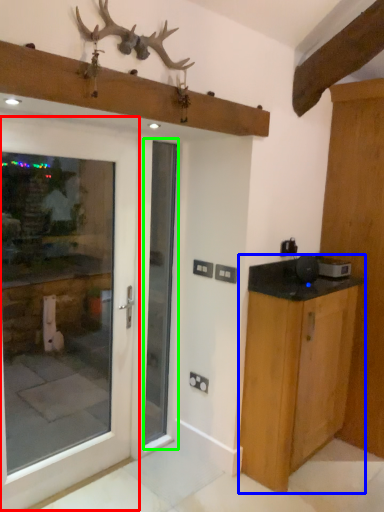
Question: Which is farther away from door (highlighted by a red box)? cabinetry (highlighted by a blue box) or screen door (highlighted by a green box)?

Choices:
 (A) cabinetry
 (B) screen door

Answer: (A)